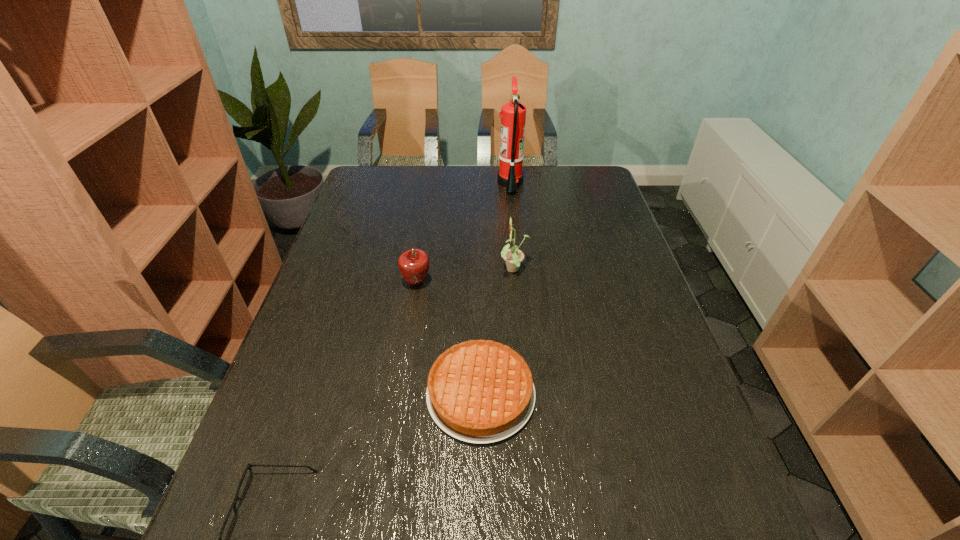
Identify the location of vacant region located on the front-facing side of the second tallest object. (441, 271).

Identify the location of blank space located 0.300m on the front-facing side of the second tallest object. The width and height of the screenshot is (960, 540). (396, 271).

Identify the location of vacant region located 0.300m on the front-facing side of the second tallest object. (396, 271).

What are the coordinates of `free space located 0.240m on the front of the third tallest object` in the screenshot? It's located at (404, 364).

What are the coordinates of `vacant point located 0.130m on the back of the fourth tallest object` in the screenshot? It's located at (481, 313).

I want to click on object located at the far edge, so click(513, 114).

You are a GUI agent. You are given a task and a screenshot of the screen. Output one action in this format:
    pyautogui.click(x=<x>, y=<y>)
    Task: Click on the vacant area at the far edge
    This screenshot has width=960, height=540.
    Given the screenshot: What is the action you would take?
    pyautogui.click(x=405, y=195)

Find the location of a particular element. The height and width of the screenshot is (540, 960). free space at the left edge of the desktop is located at coordinates (365, 278).

Where is `vacant space at the right edge of the desktop`? vacant space at the right edge of the desktop is located at coordinates (628, 335).

The width and height of the screenshot is (960, 540). I want to click on vacant space at the far right corner, so click(592, 192).